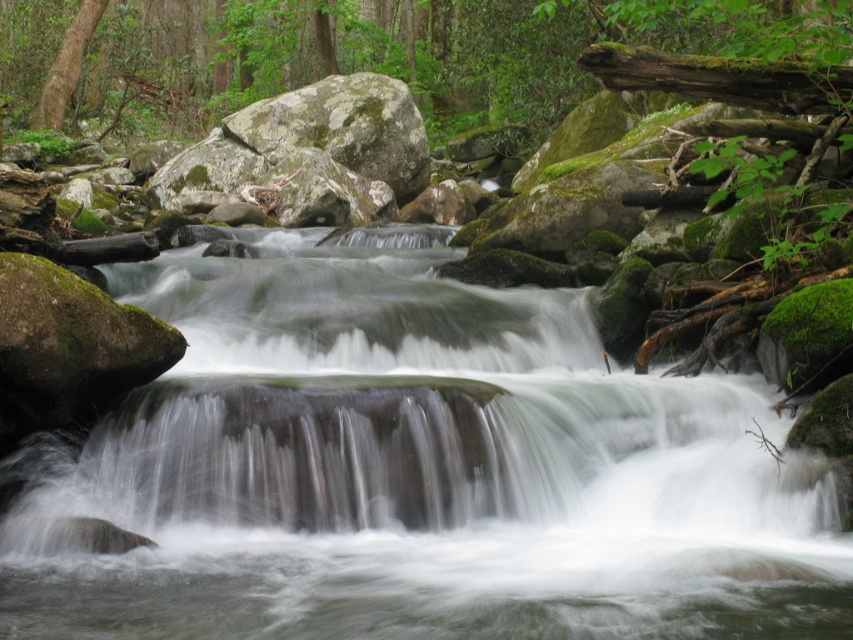
Does point (315, 268) lie in front of point (24, 100)?

Yes, it is in front of point (24, 100).

Where is `clear water at center`? The width and height of the screenshot is (853, 640). clear water at center is located at coordinates (415, 472).

Between point (227, 282) and point (247, 83), which one is positioned in front?

Point (227, 282)

Where is `clear water at center`? The width and height of the screenshot is (853, 640). clear water at center is located at coordinates (415, 472).